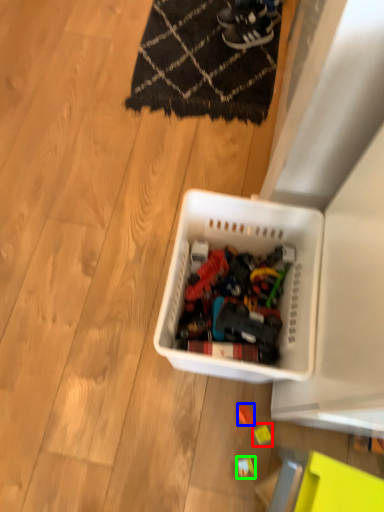
Question: Based on their relative distances, which object is farther from toy (highlighted by a red box)? Choose from toy (highlighted by a blue box) and toy (highlighted by a green box).

Choices:
 (A) toy
 (B) toy

Answer: (B)